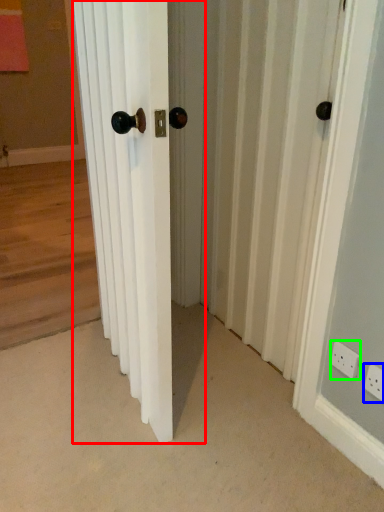
Question: Estimate the real-world distances between objects in this image. Which object is farther from door (highlighted by a red box), electric outlet (highlighted by a blue box) or electric outlet (highlighted by a green box)?

Choices:
 (A) electric outlet
 (B) electric outlet

Answer: (A)